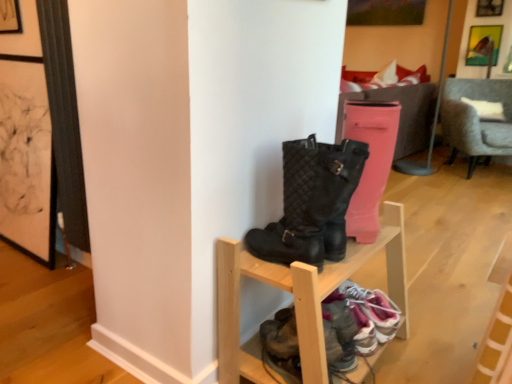
What do you see at coordinates (386, 75) in the screenshot? This screenshot has width=512, height=384. I see `white fabric pillow at upper center` at bounding box center [386, 75].

Measure the distance between point (471, 148) and camera.

They are 11.67 feet apart.

The height and width of the screenshot is (384, 512). I want to click on gray fabric chair at right, so click(476, 120).

In the scene shown: How much space does pink fabric sneaker at lower right, placed as the 1th footwear when sorted from right to left, occupy vertically?

pink fabric sneaker at lower right, placed as the 1th footwear when sorted from right to left, is 6.00 inches in height.

The image size is (512, 384). In order to click on white fabric pillow at upper center in this screenshot , I will do `click(386, 75)`.

From the image's perspective, relative to gray fabric chair at right, is white fabric pillow at upper center above or below?

Based on their image positions, white fabric pillow at upper center is located above gray fabric chair at right.

How many degrees apart are the facing directions of white fabric pillow at upper center and gray fabric chair at right?

The angular difference between white fabric pillow at upper center and gray fabric chair at right is 133 degrees.

Is white fabric pillow at upper center in front of or behind gray fabric chair at right in the image?

Visually, white fabric pillow at upper center is located behind gray fabric chair at right.

Is wooden shoe rack at center to the left or to the right of metallic gold picture frame at upper right in the image?

From the image, it's evident that wooden shoe rack at center is to the left of metallic gold picture frame at upper right.

From the image's perspective, is wooden shoe rack at center located beneath metallic gold picture frame at upper right?

Yes, from the image's perspective, wooden shoe rack at center is below metallic gold picture frame at upper right.

Considering the sizes of wooden shoe rack at center and metallic gold picture frame at upper right in the image, is wooden shoe rack at center taller or shorter than metallic gold picture frame at upper right?

In the image, wooden shoe rack at center appears to be taller than metallic gold picture frame at upper right.

Relative to black quilted boots at center, is metallic gold picture frame at upper right in front or behind?

Clearly, metallic gold picture frame at upper right is behind black quilted boots at center.

The height and width of the screenshot is (384, 512). In order to click on boot in front of the metallic gold picture frame at upper right in this screenshot , I will do `click(312, 203)`.

Is black quilted boots at center a part of metallic gold picture frame at upper right?

No.

Based on the photo, from the image's perspective, is metallic gold picture frame at upper right beneath black quilted boots at center?

Incorrect, from the image's perspective, metallic gold picture frame at upper right is higher than black quilted boots at center.

From the image's perspective, which is below, wooden shoe rack at center or pink fabric sneaker at lower right, placed as the 1th footwear when sorted from right to left?

pink fabric sneaker at lower right, placed as the 1th footwear when sorted from right to left, from the image's perspective.

Considering the relative sizes of wooden shoe rack at center and pink fabric sneaker at lower right, acting as the second footwear starting from the left, in the image provided, is wooden shoe rack at center taller than pink fabric sneaker at lower right, acting as the second footwear starting from the left,?

Yes.

In the scene shown: Is wooden shoe rack at center not close to pink fabric sneaker at lower right, acting as the second footwear starting from the left?

Actually, wooden shoe rack at center and pink fabric sneaker at lower right, acting as the second footwear starting from the left, are a little close together.

What's the angular difference between wooden shoe rack at center and pink fabric sneaker at lower right, acting as the second footwear starting from the left,'s facing directions?

180 degrees.

Is wooden shoe rack at center not near black quilted boots at center?

wooden shoe rack at center is near black quilted boots at center, not far away.

Is wooden shoe rack at center spatially inside black quilted boots at center, or outside of it?

wooden shoe rack at center is spatially situated outside black quilted boots at center.

Find the location of a particular element. The height and width of the screenshot is (384, 512). boot located above the wooden shoe rack at center (from a real-world perspective) is located at coordinates (312, 203).

From a real-world perspective, is leather sneakers at lower center, positioned as the second footwear in right-to-left order, physically above white fabric pillow at upper center?

No, from a real-world perspective, leather sneakers at lower center, positioned as the second footwear in right-to-left order, is not on top of white fabric pillow at upper center.

Which is nearer, (353, 317) or (390, 83)?

Clearly, point (353, 317) is closer to the camera than point (390, 83).

Locate an element on the screen. picture frame above the leather sneakers at lower center, positioned as the second footwear in right-to-left order (from a real-world perspective) is located at coordinates (483, 45).

From the image's perspective, which is above, metallic gold picture frame at upper right or leather sneakers at lower center, which appears as the 1th footwear when viewed from the left?

metallic gold picture frame at upper right is shown above in the image.

Are metallic gold picture frame at upper right and leather sneakers at lower center, positioned as the second footwear in right-to-left order, far apart?

Yes, metallic gold picture frame at upper right and leather sneakers at lower center, positioned as the second footwear in right-to-left order, are located far from each other.

Which of these two, metallic gold picture frame at upper right or leather sneakers at lower center, positioned as the second footwear in right-to-left order, stands shorter?

leather sneakers at lower center, positioned as the second footwear in right-to-left order.

Where is `chair lying on the right of white fabric pillow at upper center`? The width and height of the screenshot is (512, 384). chair lying on the right of white fabric pillow at upper center is located at coordinates (476, 120).

Where is `picture frame behind the wooden shoe rack at center`? This screenshot has height=384, width=512. picture frame behind the wooden shoe rack at center is located at coordinates [483, 45].

Based on their spatial positions, is white fabric pillow at upper center or wooden shoe rack at center further from metallic gold picture frame at upper right?

wooden shoe rack at center lies further to metallic gold picture frame at upper right than the other object.

Based on their spatial positions, is white fabric pillow at upper center or black quilted boots at center further from gray fabric chair at right?

black quilted boots at center.

Considering their positions, is wooden shoe rack at center positioned closer to white fabric pillow at upper center than leather sneakers at lower center, which appears as the 1th footwear when viewed from the left?

Among the two, wooden shoe rack at center is located nearer to white fabric pillow at upper center.

Looking at the image, which one is located further to wooden shoe rack at center, leather sneakers at lower center, which appears as the 1th footwear when viewed from the left, or black quilted boots at center?

The object further to wooden shoe rack at center is black quilted boots at center.

Based on their spatial positions, is wooden shoe rack at center or leather sneakers at lower center, positioned as the second footwear in right-to-left order, further from black quilted boots at center?

leather sneakers at lower center, positioned as the second footwear in right-to-left order, is positioned further to the anchor black quilted boots at center.

Looking at the image, which one is located further to gray fabric chair at right, white fabric pillow at upper center or wooden shoe rack at center?

Based on the image, wooden shoe rack at center appears to be further to gray fabric chair at right.

Which object lies nearer to the anchor point leather sneakers at lower center, positioned as the second footwear in right-to-left order, gray fabric chair at right or wooden shoe rack at center?

wooden shoe rack at center.

Which object lies nearer to the anchor point leather sneakers at lower center, which appears as the 1th footwear when viewed from the left, metallic gold picture frame at upper right or pink fabric sneaker at lower right, acting as the second footwear starting from the left?

Based on the image, pink fabric sneaker at lower right, acting as the second footwear starting from the left, appears to be nearer to leather sneakers at lower center, which appears as the 1th footwear when viewed from the left.

The width and height of the screenshot is (512, 384). I want to click on shelf between black quilted boots at center and leather sneakers at lower center, which appears as the 1th footwear when viewed from the left, in the vertical direction, so (298, 298).

Identify the location of footwear that lies between black quilted boots at center and leather sneakers at lower center, which appears as the 1th footwear when viewed from the left, from top to bottom. pyautogui.click(x=374, y=309).

This screenshot has height=384, width=512. I want to click on boot located between wooden shoe rack at center and metallic gold picture frame at upper right in the depth direction, so 312,203.

You are a GUI agent. You are given a task and a screenshot of the screen. Output one action in this format:
    pyautogui.click(x=<x>, y=<y>)
    Task: Click on the chair between black quilted boots at center and metallic gold picture frame at upper right along the z-axis
    The width and height of the screenshot is (512, 384).
    Given the screenshot: What is the action you would take?
    pyautogui.click(x=476, y=120)